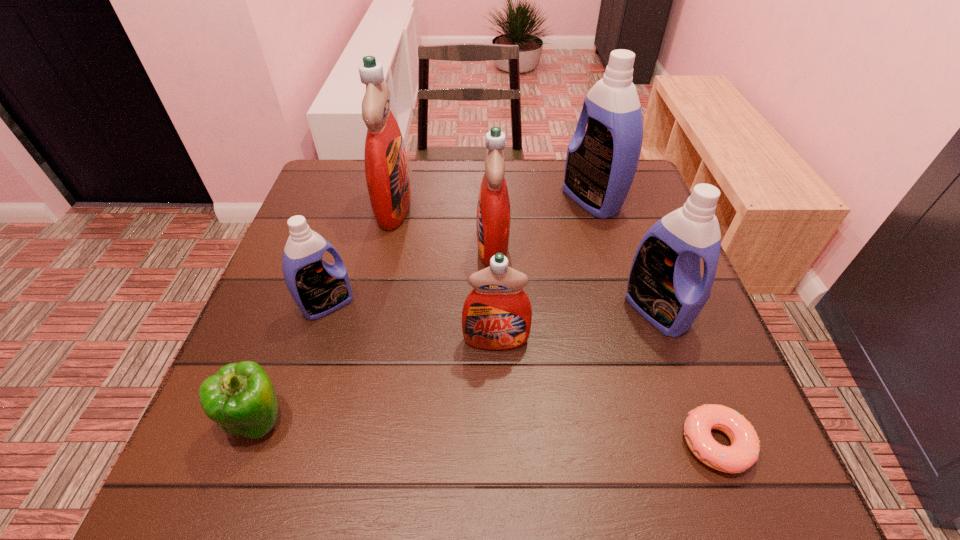
At what (x,y) coordinates should I click in order to perform the action: click on the seventh closest object to the leftmost red detergent. Please return your answer as a coordinate pair (x, y). The height and width of the screenshot is (540, 960). Looking at the image, I should click on point(744,451).

I want to click on object that is the third closest to the second smallest red detergent, so click(x=386, y=167).

Locate which detergent ranks fourth in proximity to the biggest red detergent. Please provide its 2D coordinates. Your answer should be formatted as a tuple, i.e. [(x, y)], where the tuple contains the x and y coordinates of a point satisfying the conditions above.

[(601, 163)]

Choose which detergent is the fourth nearest neighbor to the second biggest blue detergent. Please provide its 2D coordinates. Your answer should be formatted as a tuple, i.e. [(x, y)], where the tuple contains the x and y coordinates of a point satisfying the conditions above.

[(386, 167)]

This screenshot has width=960, height=540. Find the location of `the closest red detergent to the smallest blue detergent`. the closest red detergent to the smallest blue detergent is located at coordinates tap(386, 167).

Locate an element on the screen. The width and height of the screenshot is (960, 540). the third closest red detergent to the doughnut is located at coordinates (386, 167).

This screenshot has height=540, width=960. Identify the location of blue detergent that stands as the closest to the smallest blue detergent. (601, 163).

The image size is (960, 540). In order to click on blue detergent that is the nearest to the doughnut in this screenshot , I will do (665, 286).

Find the location of `free space that satisfies the following two spatial constraints: 1. on the front side of the pink doughnut; 2. on the left side of the biggest blue detergent`. free space that satisfies the following two spatial constraints: 1. on the front side of the pink doughnut; 2. on the left side of the biggest blue detergent is located at coordinates (663, 443).

Identify the location of free location that satisfies the following two spatial constraints: 1. on the front surface of the biggest red detergent; 2. on the front side of the leftmost blue detergent. (372, 305).